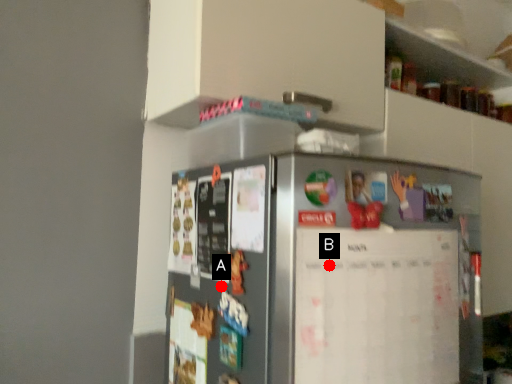
Question: Two points are circled on the image, labeled by A and B beside each circle. Which of the following is the farthest from the observer?

Choices:
 (A) A is further
 (B) B is further

Answer: (A)